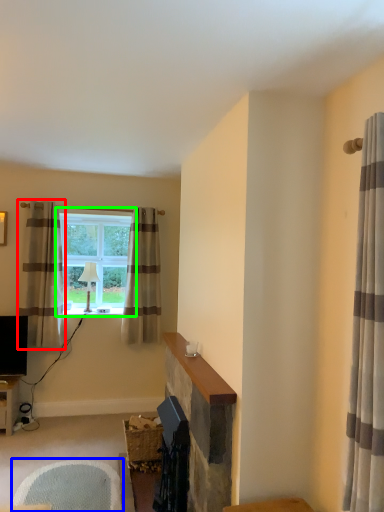
Question: Which object is the farthest from curtain (highlighted by a red box)? Choose among these: swivel chair (highlighted by a blue box) or window (highlighted by a green box).

Choices:
 (A) swivel chair
 (B) window

Answer: (A)